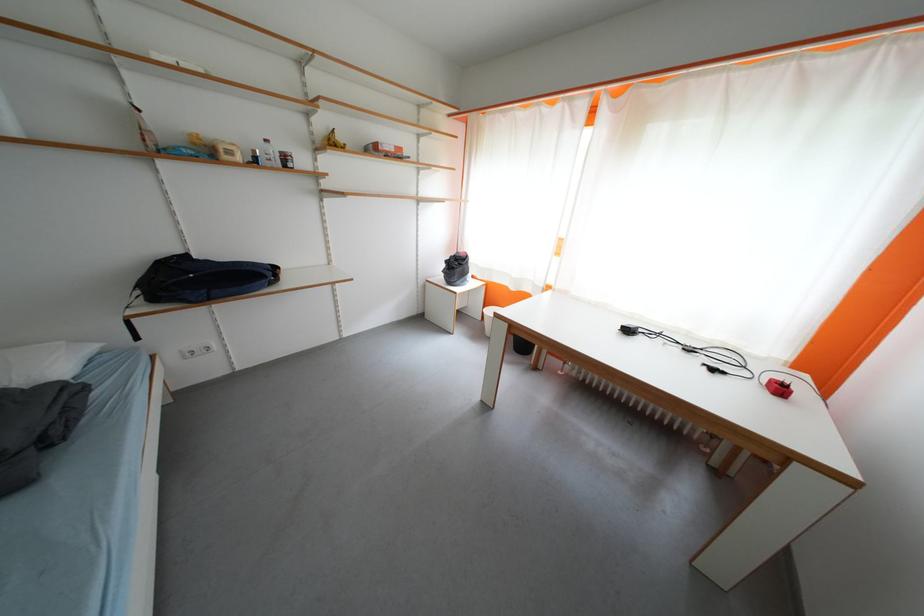
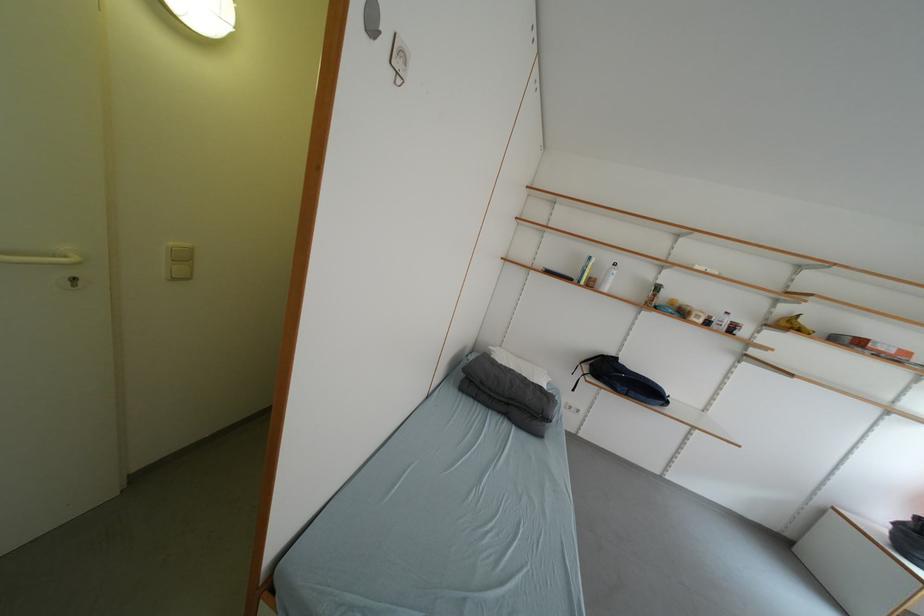
The point at [433,290] is marked in the first image. Where is the corresponding point in the second image?

(832, 515)